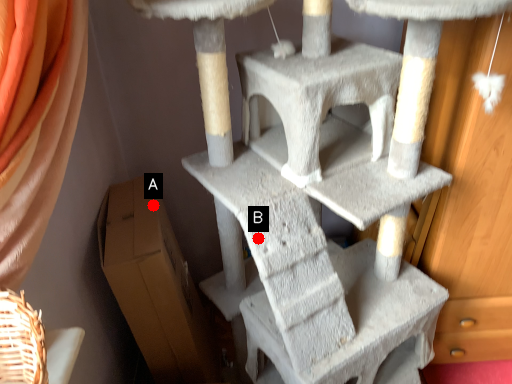
Question: Two points are circled on the image, labeled by A and B beside each circle. Which point appears closest to the camera in this image?

Choices:
 (A) A is closer
 (B) B is closer

Answer: (B)